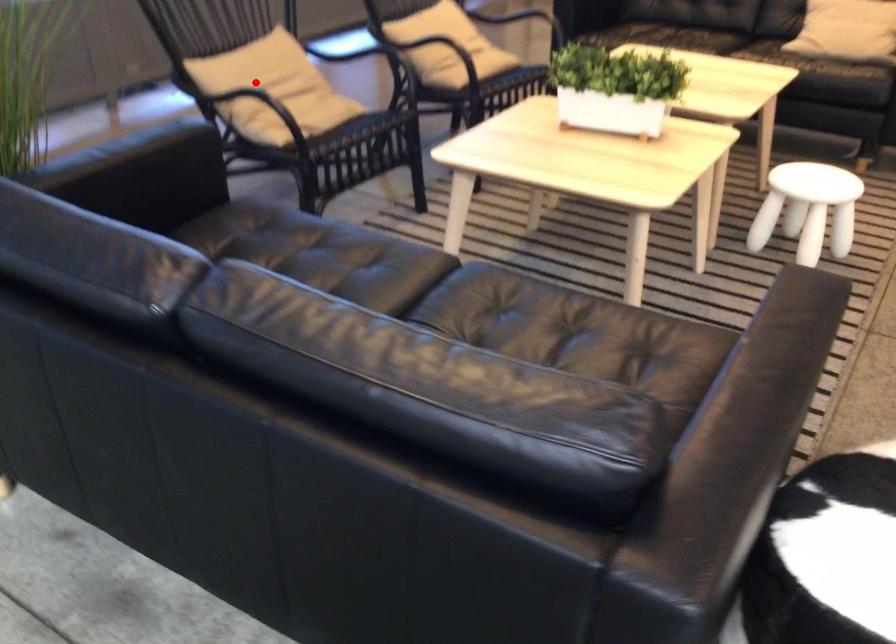
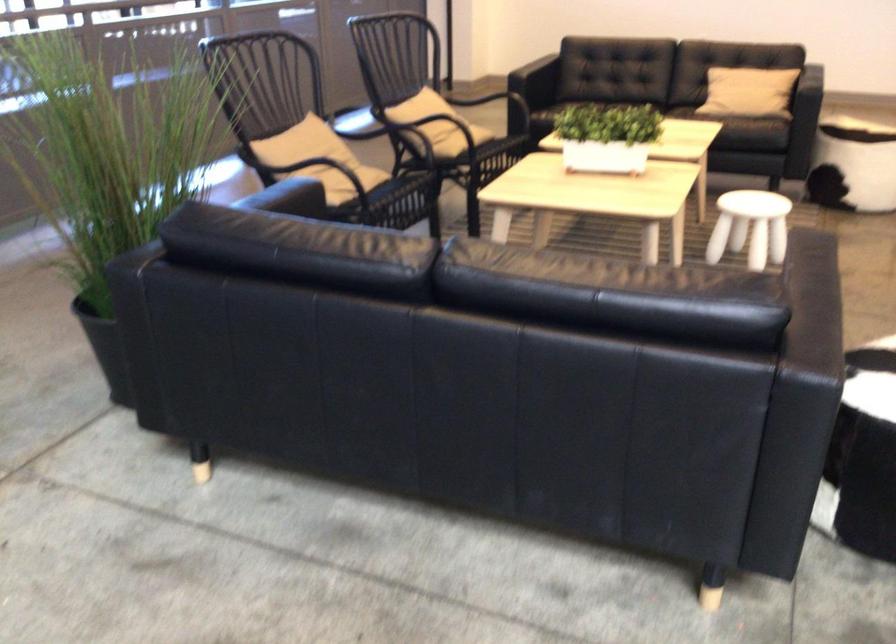
In the second image, find the point that corresponds to the highlighted location in the first image.

(308, 153)